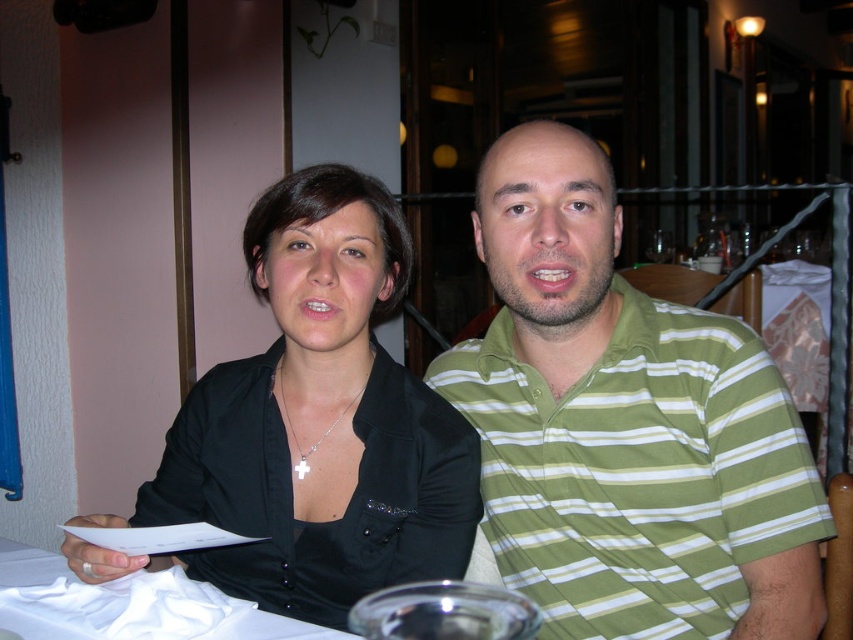
You are a photographer standing at a distance of 30 inches from the camera. You want to take a photo of the green striped polo shirt at center. Can you move closer to the shirt without exceeding the 30 inches distance limit from the camera?

The green striped polo shirt at center and camera are 32.76 inches apart from each other. Since you are already 30 inches away from the camera, you cannot move closer to the shirt without exceeding the 30 inches distance limit.

You are a photographer setting up for a group photo. You see the black matte shirt at center and the white cloth at lower left. Which object should you focus on first if you want to capture both in the frame without moving the camera?

The black matte shirt at center is positioned on the right side of white cloth at lower left. Since the white cloth at lower left is closer to the edge of the frame, you should focus on it first to ensure it stays in the shot while adjusting the composition to include the black matte shirt at center.